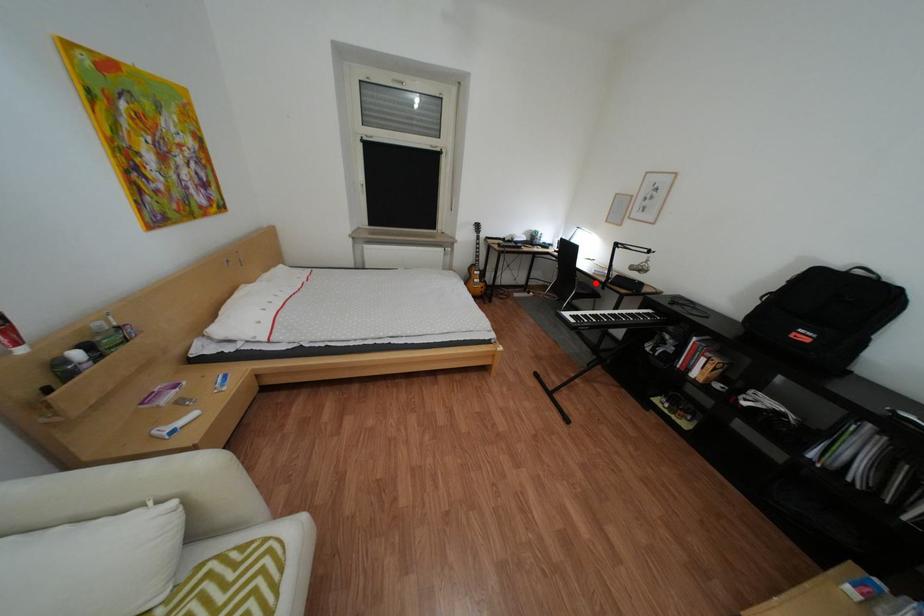
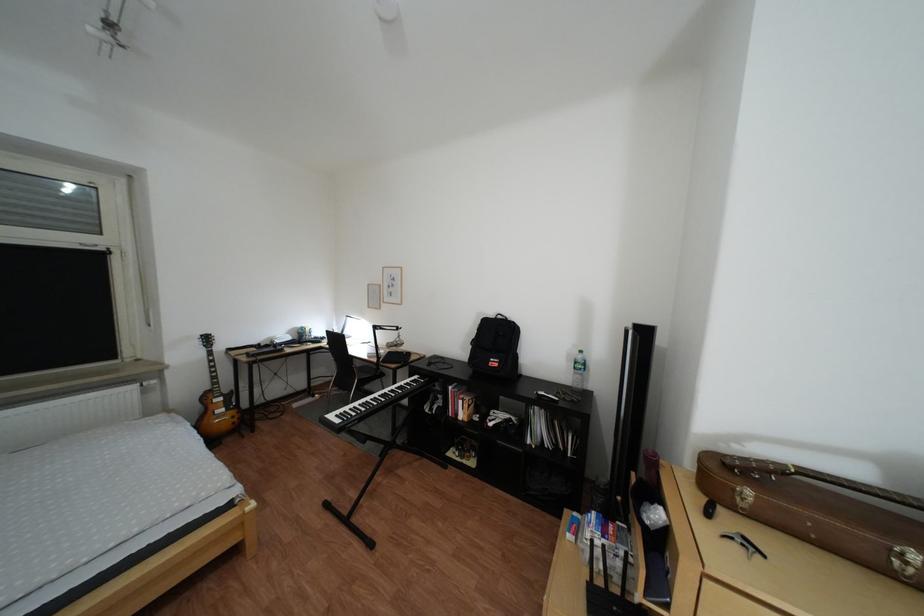
Find the pixel in the second image that matches the highlighted location in the first image.

(379, 368)